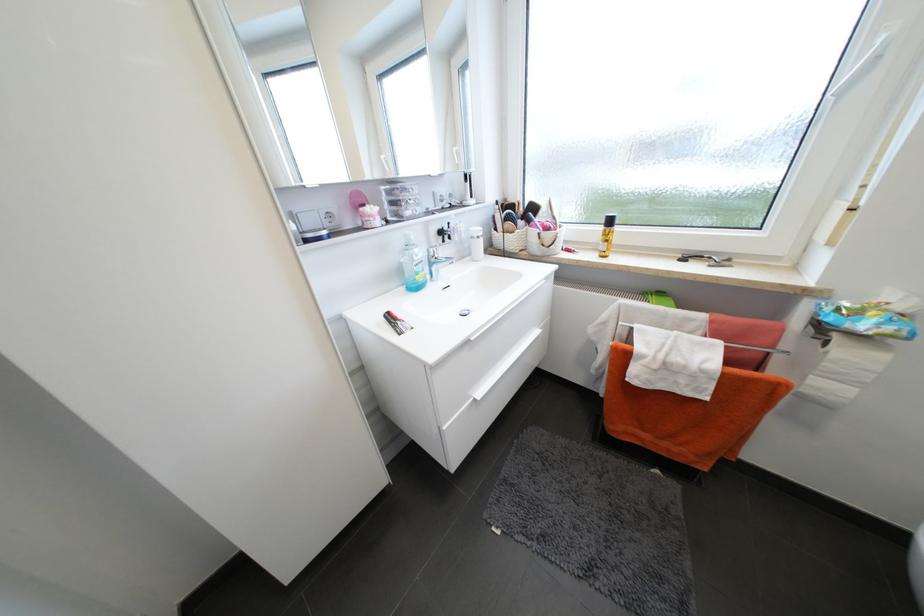
Describe the element at coordinates (505, 363) in the screenshot. I see `the white drawer handle` at that location.